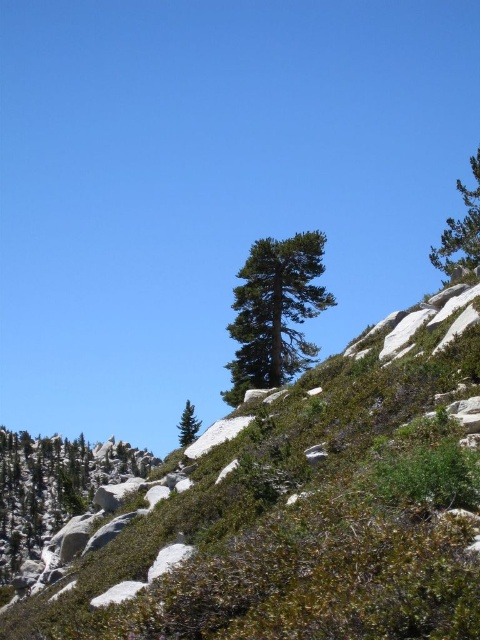
Question: Does green textured pine at center appear on the left side of green matte tree at center?

Choices:
 (A) no
 (B) yes

Answer: (A)

Question: Which point is closer to the camera taking this photo?

Choices:
 (A) (475, 236)
 (B) (271, 349)
 (C) (182, 442)

Answer: (A)

Question: Which object is farther from the camera taking this photo?

Choices:
 (A) green textured pine at upper right
 (B) green textured pine at center

Answer: (B)

Question: Can you confirm if green textured pine at center is thinner than green textured pine at upper right?

Choices:
 (A) no
 (B) yes

Answer: (B)

Question: Which object appears farthest from the camera in this image?

Choices:
 (A) green textured pine at center
 (B) green matte tree at center

Answer: (B)

Question: From the image, what is the correct spatial relationship of green textured pine at center in relation to green matte tree at center?

Choices:
 (A) above
 (B) below

Answer: (A)